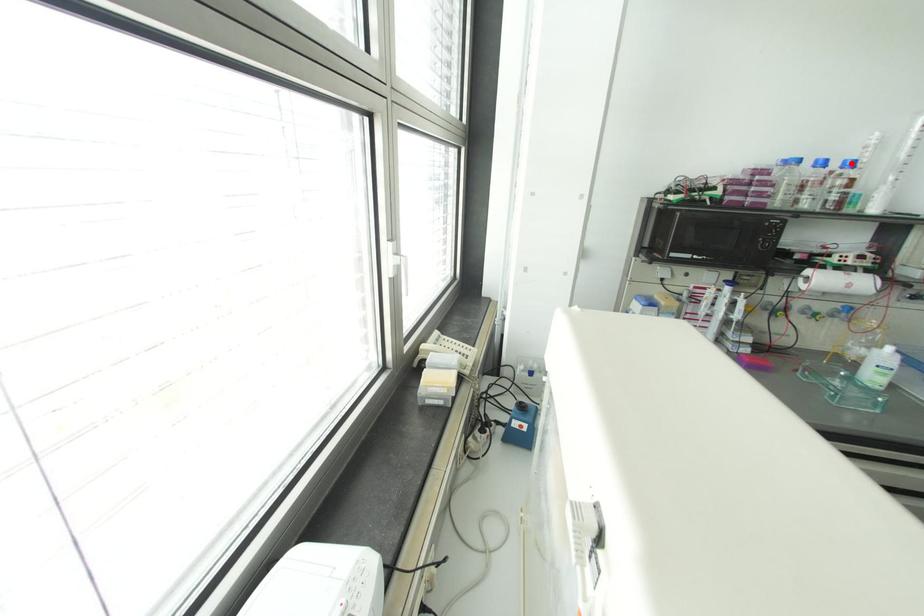
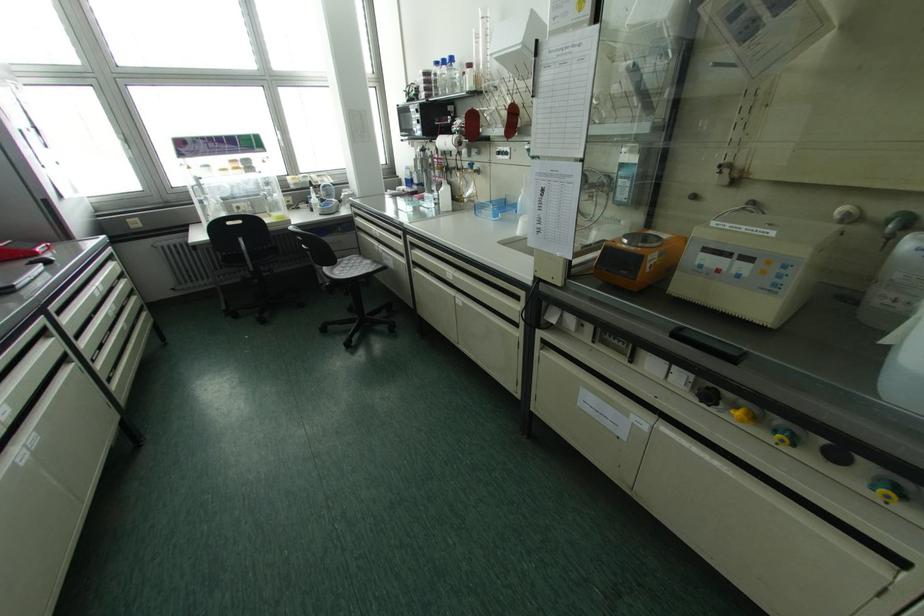
Question: I am providing you with two images of the same scene from different viewpoints. A red point is shown in image1. For the corresponding object point in image2, is it positioned nearer or farther from the camera?

Choices:
 (A) Nearer
 (B) Farther

Answer: (A)